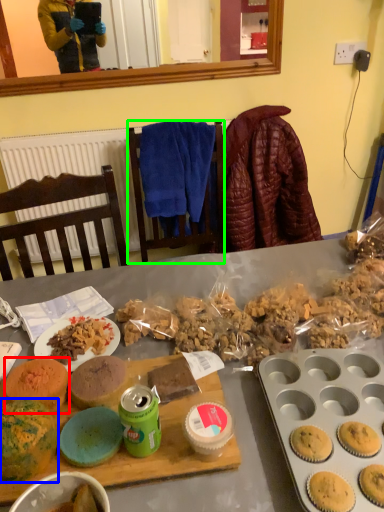
Question: Which object is positioned farthest from snack (highlighted by a red box)? Select from snack (highlighted by a blue box) and chair (highlighted by a green box).

Choices:
 (A) snack
 (B) chair

Answer: (B)